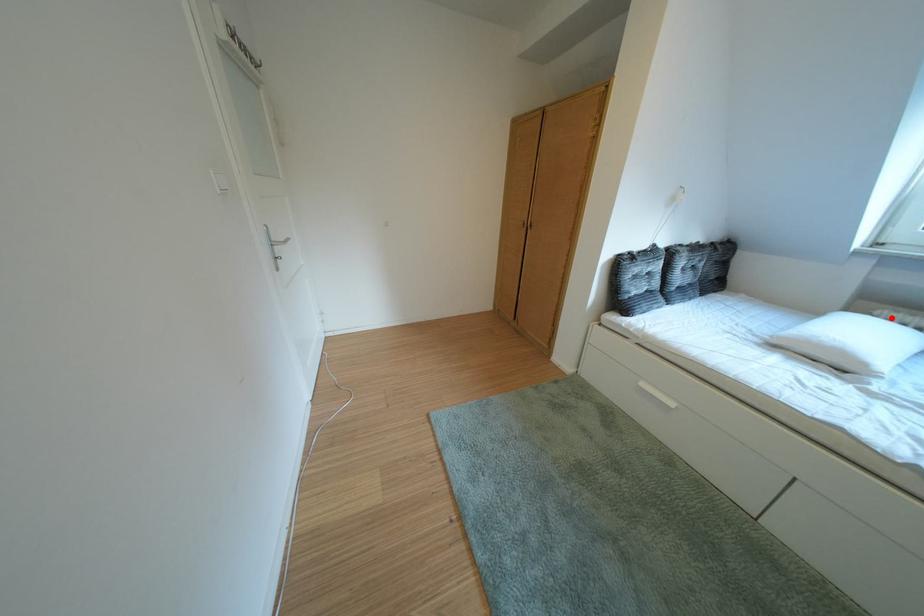
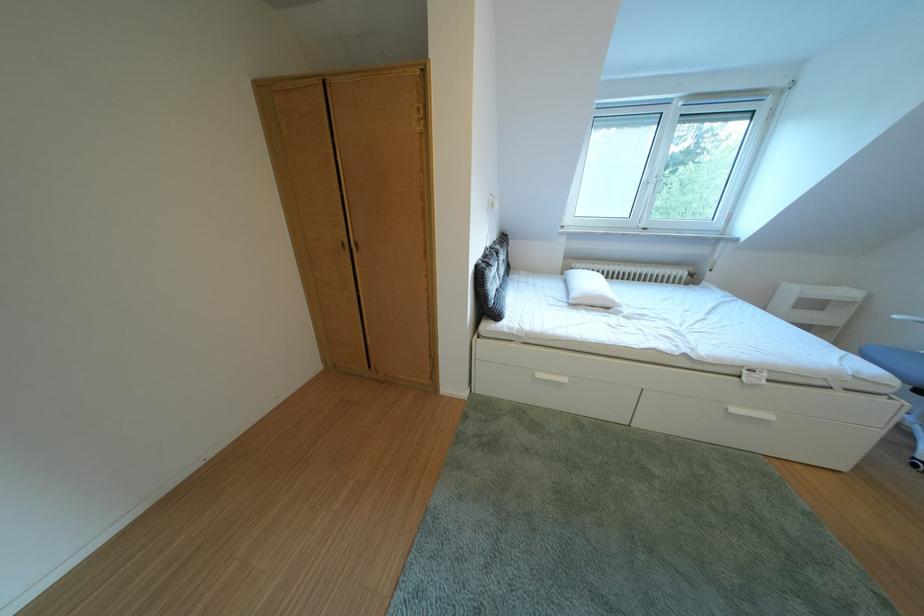
Question: I am providing you with two images of the same scene from different viewpoints. Image1 has a red point marked. In image2, the corresponding 3D location appears at what relative position? Reply with the corresponding letter.

Choices:
 (A) Closer
 (B) Farther

Answer: (B)